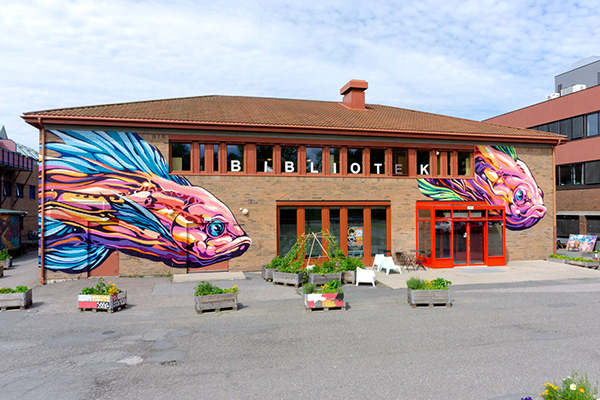
At what (x,y) coordinates should I click in order to perform the action: click on wall. Please return your answer as a coordinate pair (x, y). Looking at the image, I should click on (235, 189).